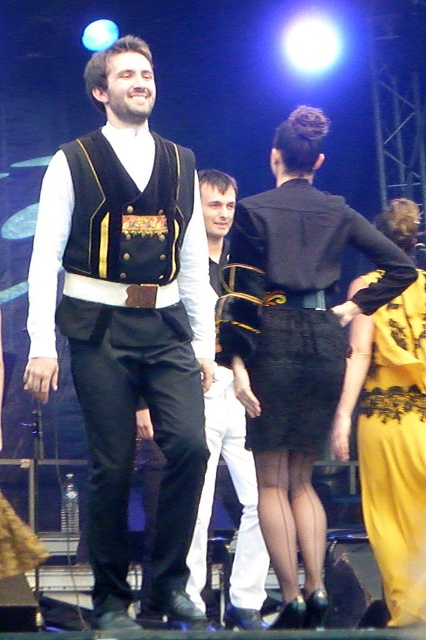
Question: Which point appears farthest from the camera in this image?

Choices:
 (A) (420, 314)
 (B) (294, 192)
 (C) (216, 220)

Answer: (C)

Question: Among these objects, which one is nearest to the camera?

Choices:
 (A) yellow lace dress at right
 (B) matte black vest at center

Answer: (B)

Question: Does matte black vest at center appear over white cotton pants at center?

Choices:
 (A) no
 (B) yes

Answer: (B)

Question: Estimate the real-world distances between objects in this image. Which object is farther from the matte black vest at center?

Choices:
 (A) white cotton pants at center
 (B) black lace skirt at center

Answer: (A)

Question: Is the position of black lace skirt at center more distant than that of yellow lace dress at right?

Choices:
 (A) no
 (B) yes

Answer: (A)

Question: Can you confirm if black lace skirt at center is positioned above white cotton pants at center?

Choices:
 (A) yes
 (B) no

Answer: (A)